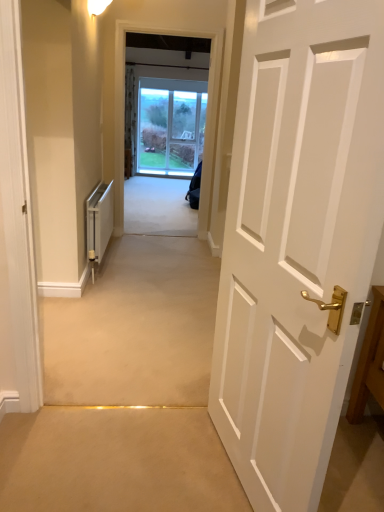
Question: In the image, is white metallic radiator at left positioned in front of or behind white painted wood door at right?

Choices:
 (A) front
 (B) behind

Answer: (B)

Question: From the image's perspective, is white metallic radiator at left located above or below white painted wood door at right?

Choices:
 (A) above
 (B) below

Answer: (A)

Question: Looking at their shapes, would you say white metallic radiator at left is wider or thinner than white painted wood door at right?

Choices:
 (A) thin
 (B) wide

Answer: (B)

Question: In terms of size, does white painted wood door at right appear bigger or smaller than white metallic radiator at left?

Choices:
 (A) small
 (B) big

Answer: (B)

Question: From the image's perspective, relative to white metallic radiator at left, is white painted wood door at right above or below?

Choices:
 (A) above
 (B) below

Answer: (B)

Question: Considering their positions, is white painted wood door at right located in front of or behind white metallic radiator at left?

Choices:
 (A) front
 (B) behind

Answer: (A)

Question: Considering the positions of white painted wood door at right and white metallic radiator at left in the image, is white painted wood door at right wider or thinner than white metallic radiator at left?

Choices:
 (A) thin
 (B) wide

Answer: (A)